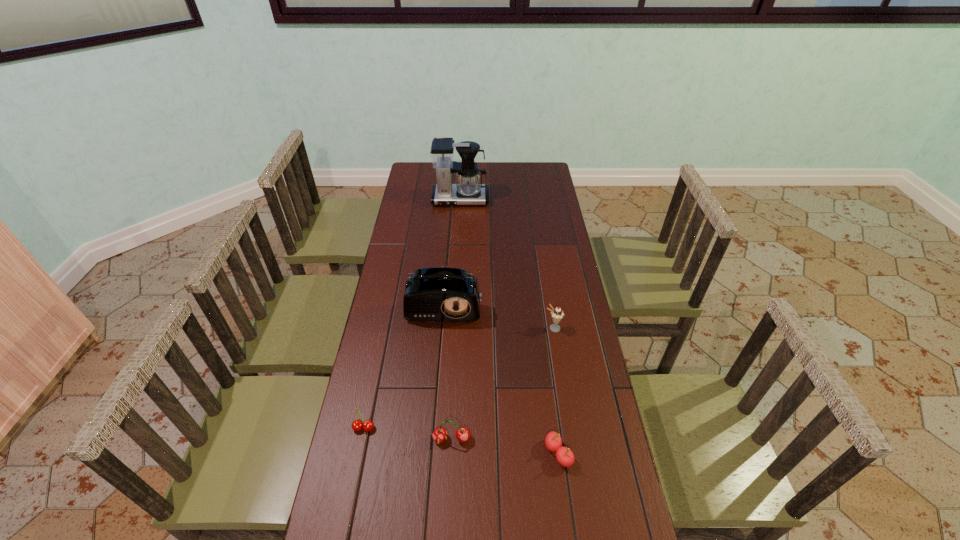
This screenshot has width=960, height=540. Find the location of `free location located 0.050m on the back of the fourth shortest object`. free location located 0.050m on the back of the fourth shortest object is located at coordinates (550, 313).

At what (x,y) coordinates should I click in order to perform the action: click on free space located with stems pointing upwards on the third shortest object. Please return your answer as a coordinate pair (x, y). This screenshot has height=540, width=960. Looking at the image, I should click on (446, 539).

Image resolution: width=960 pixels, height=540 pixels. What are the coordinates of `free space located 0.170m with the stems of the leftmost cherry pointing upwards` in the screenshot? It's located at click(349, 496).

Identify the location of vacant space located 0.160m on the left of the rightmost cherry. (487, 453).

Image resolution: width=960 pixels, height=540 pixels. I want to click on coffee maker at the left edge, so click(468, 190).

Locate an element on the screen. radio receiver situated at the left edge is located at coordinates (437, 294).

Find the location of a particular element. cherry that is at the left edge is located at coordinates (357, 425).

I want to click on icecream that is at the right edge, so click(557, 314).

The height and width of the screenshot is (540, 960). Find the location of `cherry that is at the right edge`. cherry that is at the right edge is located at coordinates coord(553,441).

At what (x,y) coordinates should I click in order to perform the action: click on vacant area at the far edge. Please return your answer as a coordinate pair (x, y). This screenshot has height=540, width=960. Looking at the image, I should click on (487, 184).